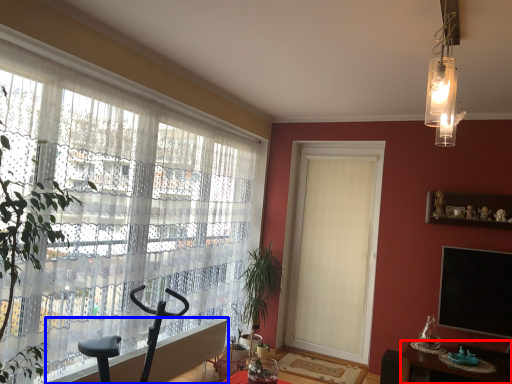
Question: Which point is further to the camera, table (highlighted by a red box) or radiator (highlighted by a blue box)?

Choices:
 (A) table
 (B) radiator

Answer: (A)